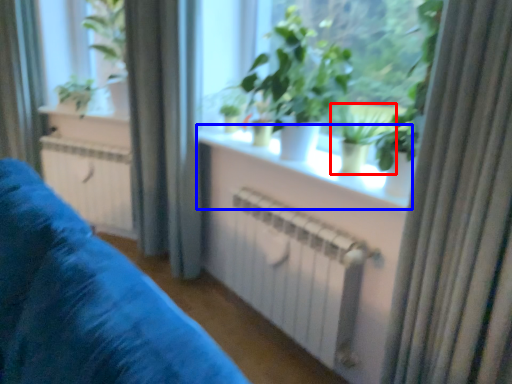
Question: Among these objects, which one is farthest to the camera, houseplant (highlighted by a red box) or window sill (highlighted by a blue box)?

Choices:
 (A) houseplant
 (B) window sill

Answer: (A)